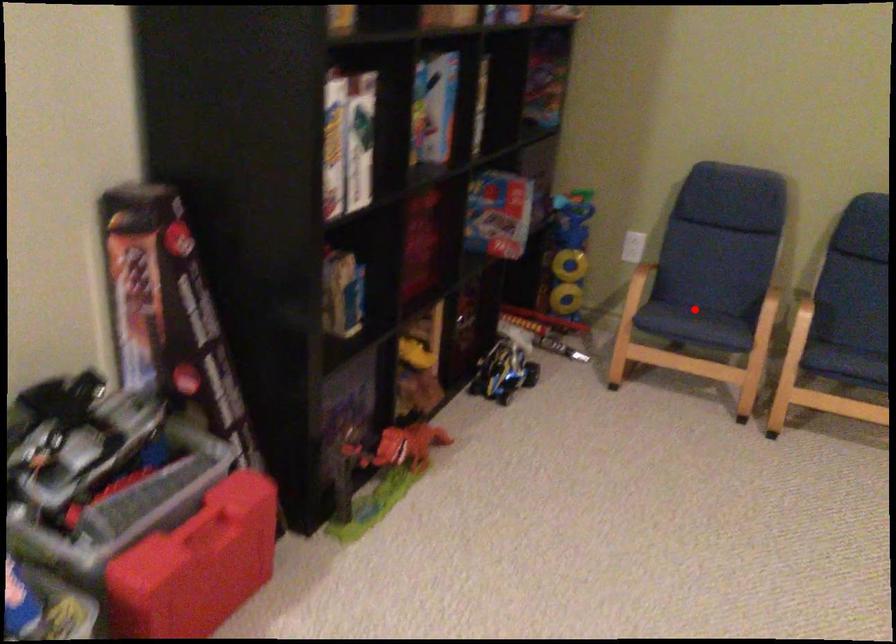
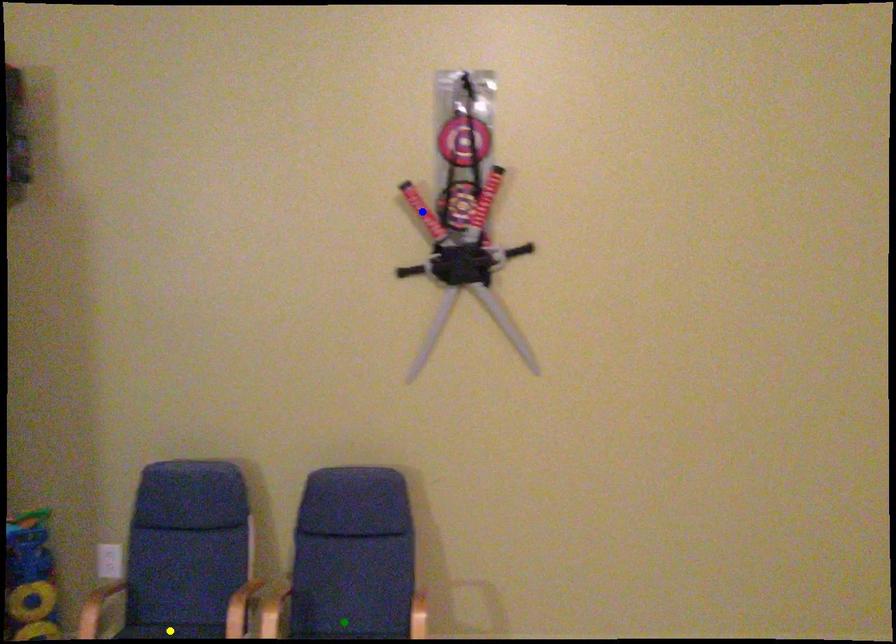
Question: I am providing you with two images of the same scene from different viewpoints. A red point is marked on the first image. You are given multiple points on the second image. Which point in image 2 is actually the same real-world point as the red point in image 1?

Choices:
 (A) blue point
 (B) yellow point
 (C) green point

Answer: (B)